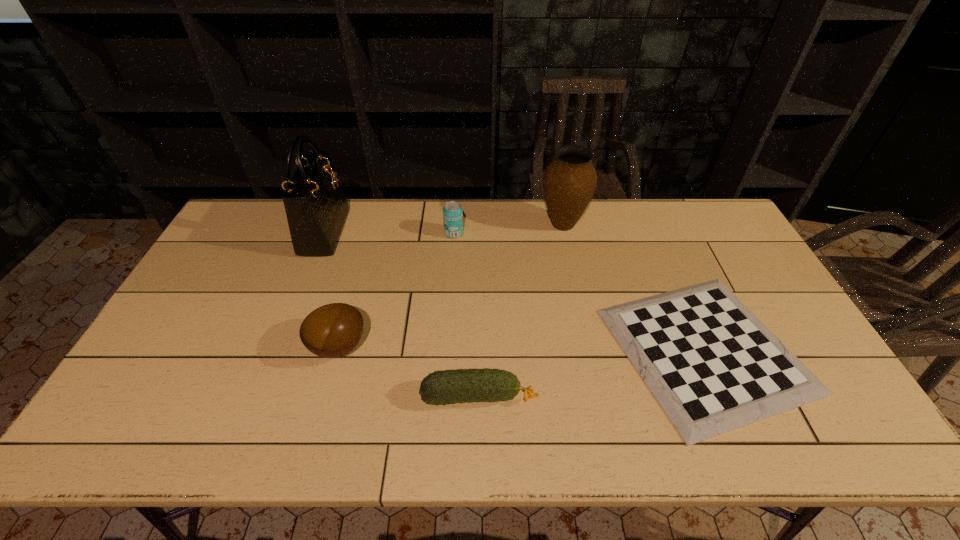
The width and height of the screenshot is (960, 540). In the image, there is a desktop. Find the location of `vacant space at the far edge`. vacant space at the far edge is located at coordinates (492, 217).

Where is `vacant space at the near edge of the desktop`? The image size is (960, 540). vacant space at the near edge of the desktop is located at coordinates (298, 431).

Find the location of a particular element. The image size is (960, 540). vacant space at the left edge of the desktop is located at coordinates (180, 328).

You are a GUI agent. You are given a task and a screenshot of the screen. Output one action in this format:
    pyautogui.click(x=<x>, y=<y>)
    Task: Click on the vacant region at the far left corner of the desktop
    This screenshot has width=960, height=540.
    Given the screenshot: What is the action you would take?
    pyautogui.click(x=238, y=236)

Identify the location of vacant space at the far right corner of the desktop. (702, 221).

The image size is (960, 540). Identify the location of vacant area that lies between the second object from left to right and the fourth shortest object. (396, 290).

Locate an element on the screen. The width and height of the screenshot is (960, 540). free space that is in between the handbag and the second object from left to right is located at coordinates (332, 289).

Image resolution: width=960 pixels, height=540 pixels. I want to click on vacant region between the tallest object and the fourth shortest object, so click(389, 232).

Image resolution: width=960 pixels, height=540 pixels. What are the coordinates of `vacant space in between the handbag and the shortest object` in the screenshot? It's located at (515, 291).

At what (x,y) coordinates should I click in order to perform the action: click on free space between the cucumber and the tallest object. Please return your answer as a coordinate pair (x, y). The width and height of the screenshot is (960, 540). Looking at the image, I should click on (401, 314).